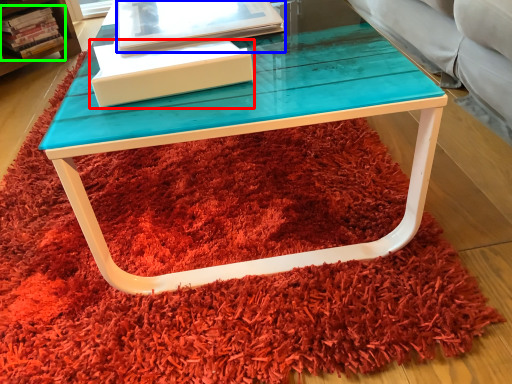
Question: Which object is the closest to the box (highlighted by a red box)? Choose among these: book (highlighted by a blue box) or book (highlighted by a green box).

Choices:
 (A) book
 (B) book

Answer: (A)